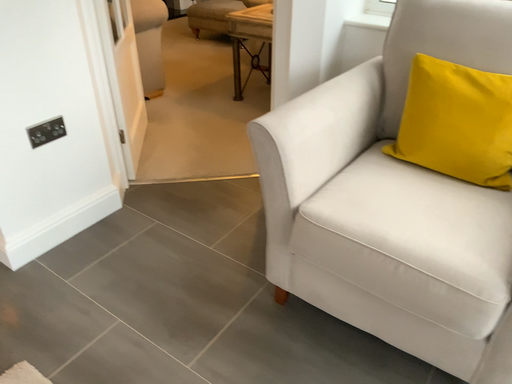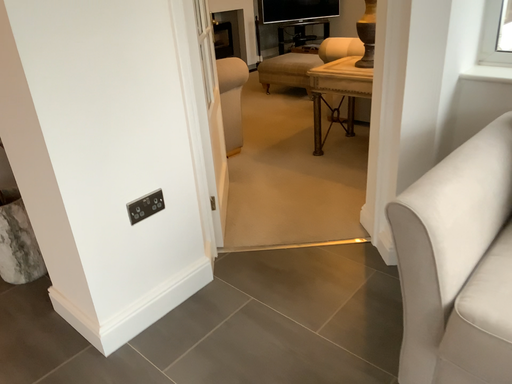
Question: Which way did the camera rotate in the video?

Choices:
 (A) rotated left
 (B) rotated right

Answer: (A)